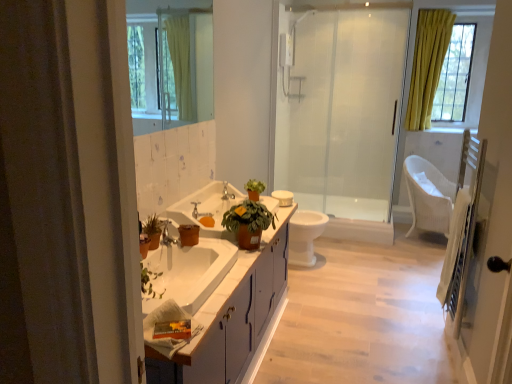
Question: Could white wooden screen door at right be considered to be inside white glossy sink at center?

Choices:
 (A) no
 (B) yes

Answer: (A)

Question: Are white glossy sink at center and white wooden screen door at right making contact?

Choices:
 (A) yes
 (B) no

Answer: (B)

Question: Is white glossy sink at center completely or partially outside of white wooden screen door at right?

Choices:
 (A) yes
 (B) no

Answer: (A)

Question: Is white glossy sink at center far away from white wooden screen door at right?

Choices:
 (A) no
 (B) yes

Answer: (B)

Question: Can you confirm if white glossy sink at center is smaller than white wooden screen door at right?

Choices:
 (A) no
 (B) yes

Answer: (A)

Question: Can you confirm if white glossy sink at center is thinner than white wooden screen door at right?

Choices:
 (A) yes
 (B) no

Answer: (B)

Question: Is white glossy sink at center far from white glossy toilet bowl at center?

Choices:
 (A) yes
 (B) no

Answer: (B)

Question: Can you confirm if white glossy sink at center is thinner than white glossy toilet bowl at center?

Choices:
 (A) yes
 (B) no

Answer: (B)

Question: Considering the relative sizes of white glossy sink at center and white glossy toilet bowl at center in the image provided, is white glossy sink at center wider than white glossy toilet bowl at center?

Choices:
 (A) yes
 (B) no

Answer: (A)

Question: Is the depth of white glossy sink at center less than that of white glossy toilet bowl at center?

Choices:
 (A) no
 (B) yes

Answer: (B)

Question: Is white glossy sink at center surrounding white glossy toilet bowl at center?

Choices:
 (A) no
 (B) yes

Answer: (A)

Question: Is white glossy sink at center positioned behind white glossy toilet bowl at center?

Choices:
 (A) no
 (B) yes

Answer: (A)

Question: Does white glossy sink at center touch transparent glass shower door at center?

Choices:
 (A) yes
 (B) no

Answer: (B)